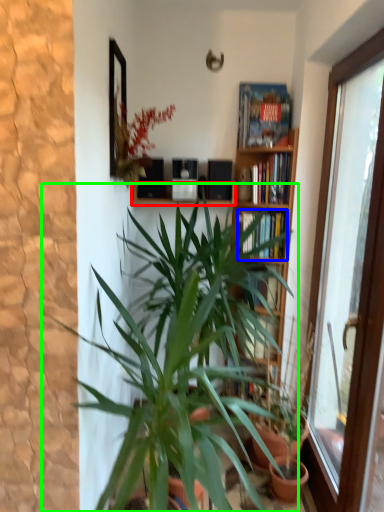
Question: Considering the real-world distances, which object is farthest from window sill (highlighted by a red box)? book (highlighted by a blue box) or houseplant (highlighted by a green box)?

Choices:
 (A) book
 (B) houseplant

Answer: (B)